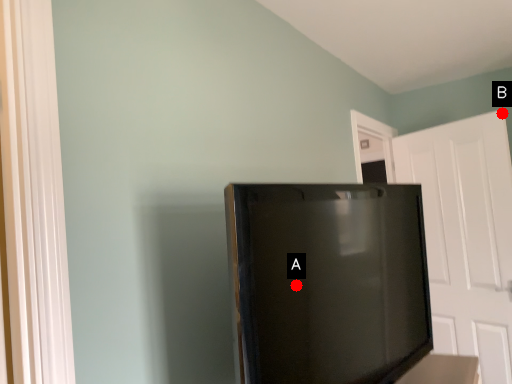
Question: Two points are circled on the image, labeled by A and B beside each circle. Among these points, which one is nearest to the camera?

Choices:
 (A) A is closer
 (B) B is closer

Answer: (A)